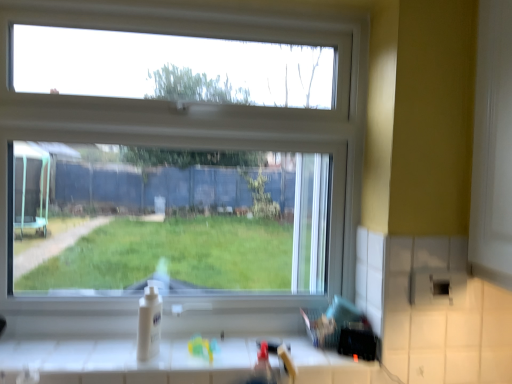
Question: Could you tell me if white glossy counter at lower center is turned towards white glossy sink at lower center?

Choices:
 (A) yes
 (B) no

Answer: (B)

Question: Are white glossy counter at lower center and white glossy sink at lower center located far from each other?

Choices:
 (A) yes
 (B) no

Answer: (B)

Question: Is the position of white glossy counter at lower center less distant than that of white glossy sink at lower center?

Choices:
 (A) no
 (B) yes

Answer: (A)

Question: Considering the relative sizes of white glossy counter at lower center and white glossy sink at lower center in the image provided, is white glossy counter at lower center wider than white glossy sink at lower center?

Choices:
 (A) yes
 (B) no

Answer: (A)

Question: From a real-world perspective, is white glossy counter at lower center positioned under white glossy sink at lower center based on gravity?

Choices:
 (A) no
 (B) yes

Answer: (B)

Question: Is white glossy counter at lower center to the right of white glossy sink at lower center from the viewer's perspective?

Choices:
 (A) no
 (B) yes

Answer: (A)

Question: From a real-world perspective, does white glossy counter at lower center stand above clear glass window at center?

Choices:
 (A) no
 (B) yes

Answer: (A)

Question: Considering the relative sizes of white glossy counter at lower center and clear glass window at center in the image provided, is white glossy counter at lower center thinner than clear glass window at center?

Choices:
 (A) yes
 (B) no

Answer: (B)

Question: Is white glossy counter at lower center next to clear glass window at center and touching it?

Choices:
 (A) no
 (B) yes

Answer: (A)

Question: Does white glossy counter at lower center have a larger size compared to clear glass window at center?

Choices:
 (A) yes
 (B) no

Answer: (B)

Question: From the image's perspective, is white glossy counter at lower center under clear glass window at center?

Choices:
 (A) yes
 (B) no

Answer: (A)

Question: From the image's perspective, would you say white glossy counter at lower center is positioned over clear glass window at center?

Choices:
 (A) no
 (B) yes

Answer: (A)

Question: Are clear glass window at center and white glossy sink at lower center located far from each other?

Choices:
 (A) no
 (B) yes

Answer: (A)